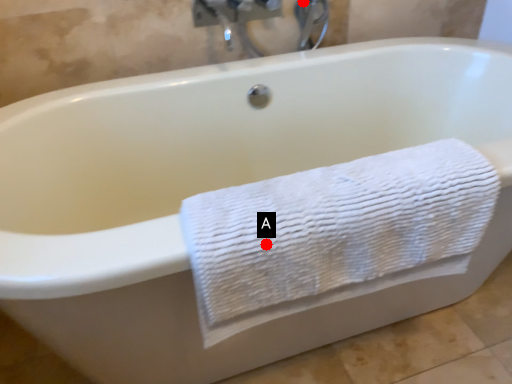
Question: Two points are circled on the image, labeled by A and B beside each circle. Which point is further to the camera?

Choices:
 (A) A is further
 (B) B is further

Answer: (B)